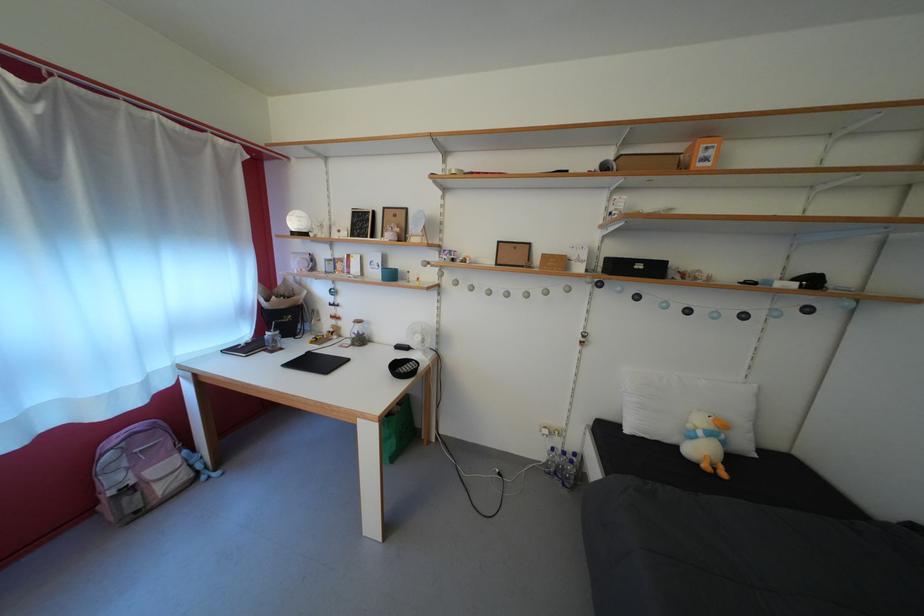
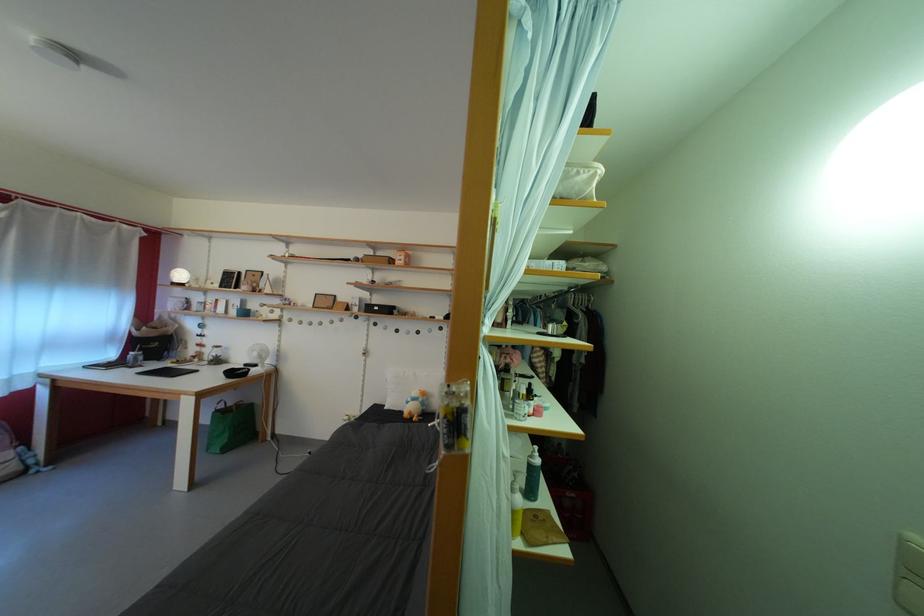
What movement of the cameraman would produce the second image?

The movement direction of the cameraman is right, backward.